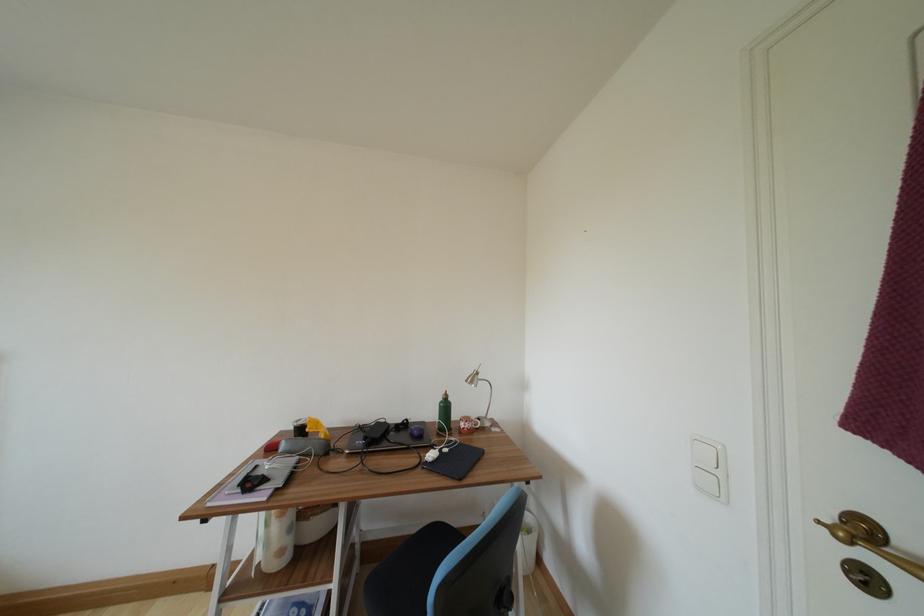
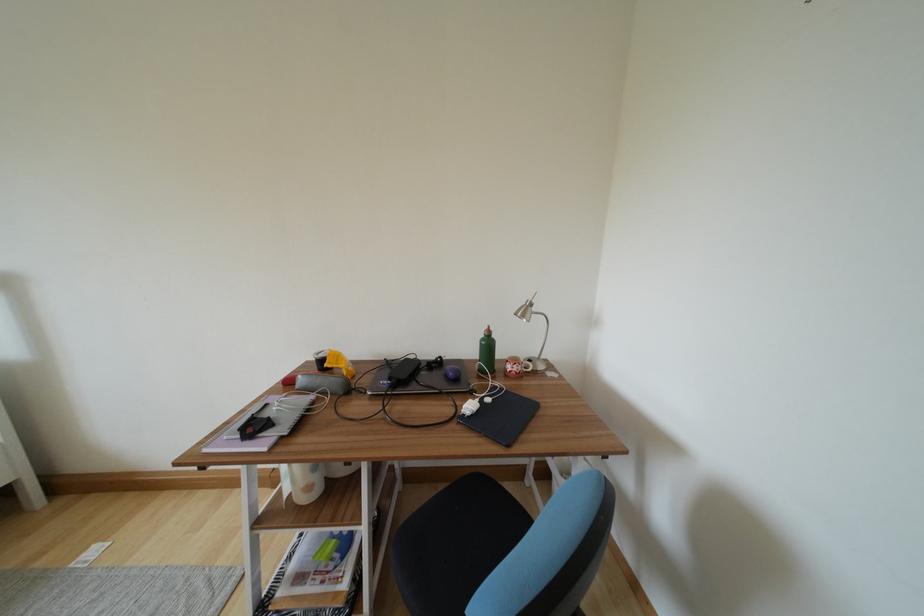
Locate, in the second image, the point that corresponds to pixel 468 429 in the first image.

(514, 371)